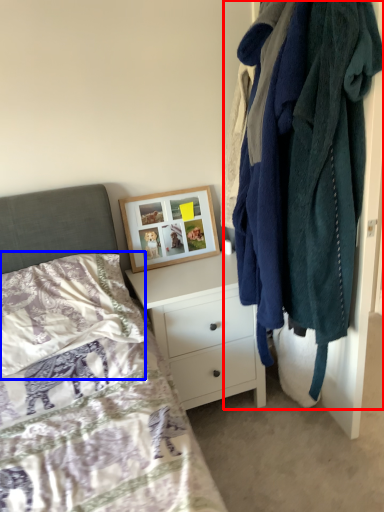
Question: Which of the following is the farthest to the observer, closet (highlighted by a red box) or pillow (highlighted by a blue box)?

Choices:
 (A) closet
 (B) pillow

Answer: (B)